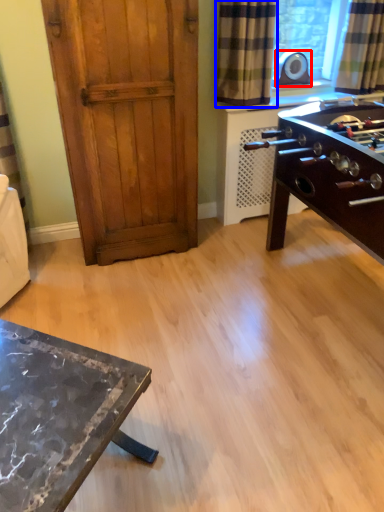
Question: Which object is closer to the camera taking this photo, appliance (highlighted by a red box) or curtain (highlighted by a blue box)?

Choices:
 (A) appliance
 (B) curtain

Answer: (B)